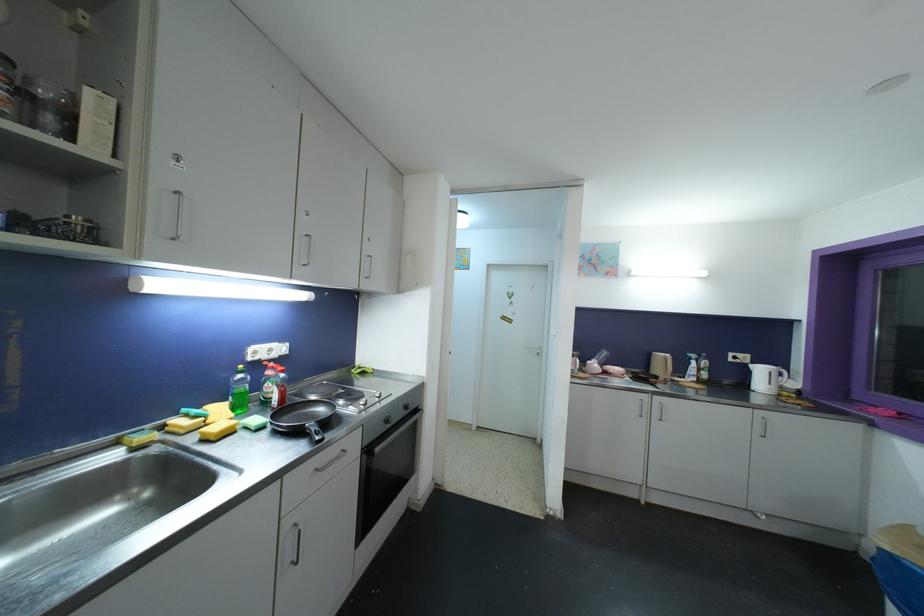
Identify the location of black oven handle. (393, 436).